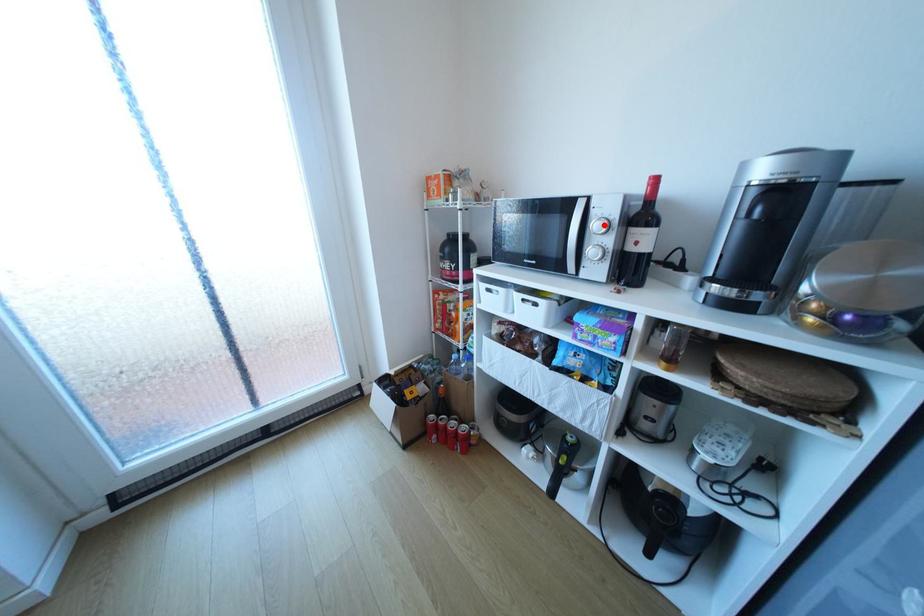
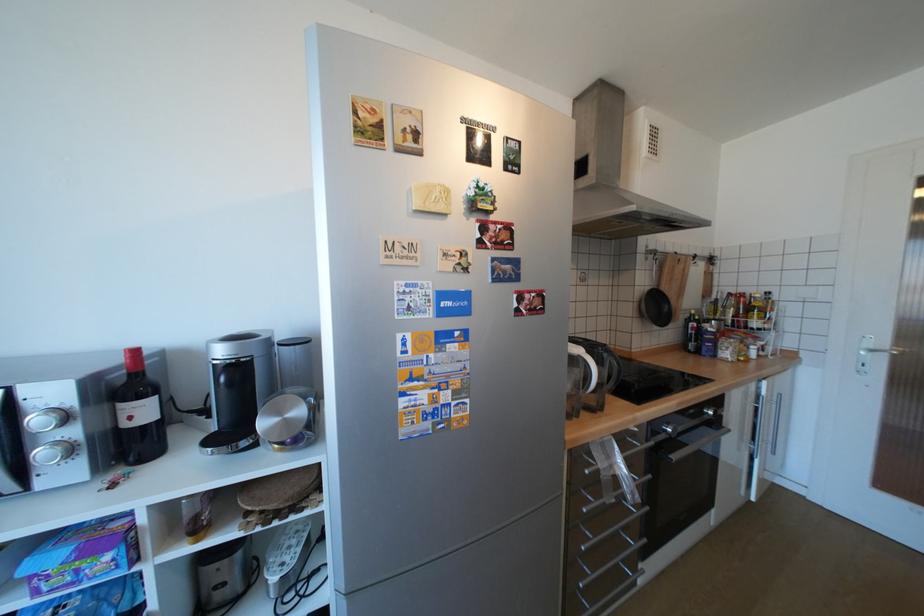
In the second image, find the point that corresponds to the highlighted location in the first image.

(46, 419)